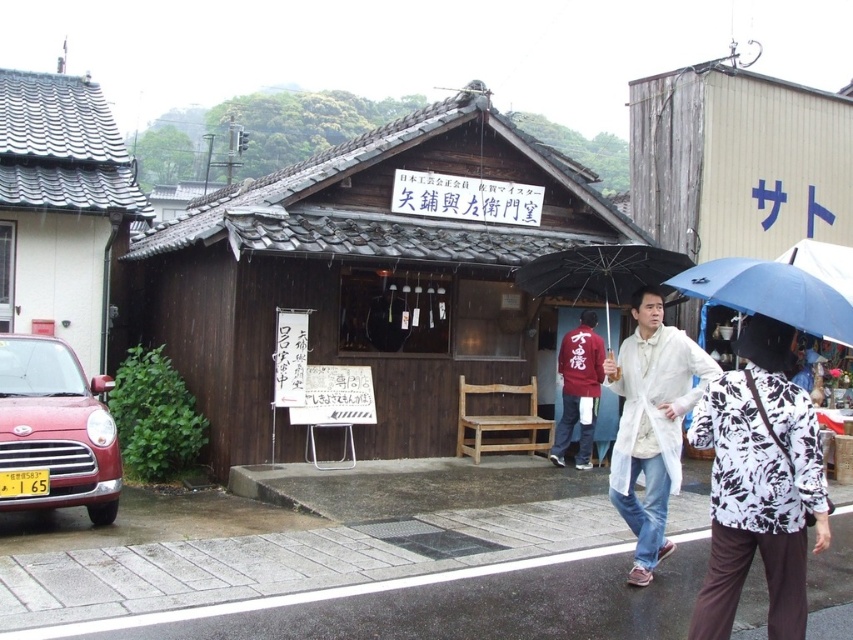
You are a visitor who wants to take a photo of the brown wooden hut at center without the blue matte umbrella at center blocking the view. Based on their sizes, is it possible to position yourself in a way that the umbrella doesn

The brown wooden hut at center is much taller than the blue matte umbrella at center, so positioning yourself at a lower angle or moving further back might allow you to frame the photo so the umbrella doesn